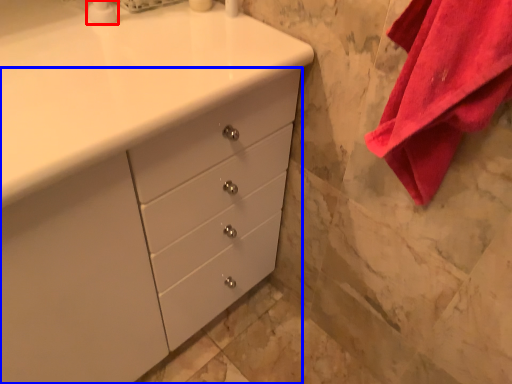
Question: Which object is closer to the camera taking this photo, soap dispenser (highlighted by a red box) or chest of drawers (highlighted by a blue box)?

Choices:
 (A) soap dispenser
 (B) chest of drawers

Answer: (B)